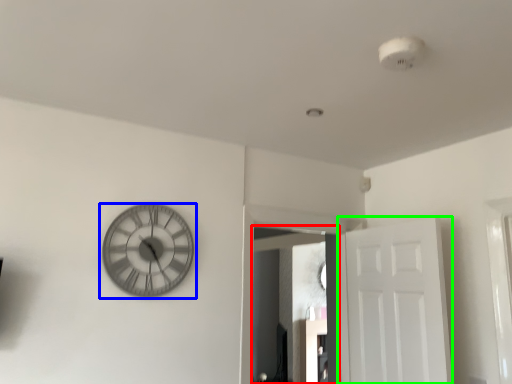
Question: Which is nearer to the mirror (highlighted by a red box)? wall clock (highlighted by a blue box) or door (highlighted by a green box).

Choices:
 (A) wall clock
 (B) door

Answer: (B)